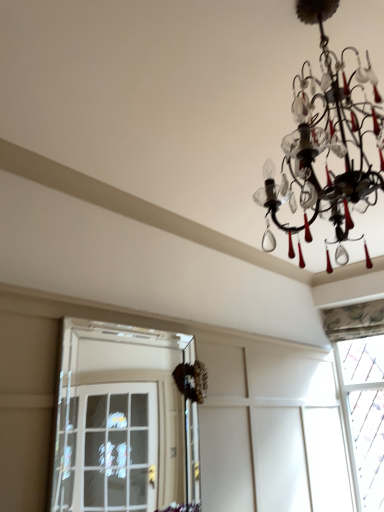
This screenshot has height=512, width=384. Identify the location of clear glass door at left, marked as the 1th window in a left-to-right arrangement. (118, 420).

You are a GUI agent. You are given a task and a screenshot of the screen. Output one action in this format:
    pyautogui.click(x=<x>, y=<y>)
    Task: Click on the clear glass door at left, which ranks as the second window in back-to-front order
    The height and width of the screenshot is (512, 384).
    Given the screenshot: What is the action you would take?
    pyautogui.click(x=118, y=420)

Considering the positions of point (366, 474) and point (383, 118), is point (366, 474) closer or farther from the camera than point (383, 118)?

Point (366, 474) is positioned farther from the camera compared to point (383, 118).

Is black glass chandelier at upper right completely or partially inside patterned fabric curtain at upper right, the first window in the right-to-left sequence?

That's incorrect, black glass chandelier at upper right is not inside patterned fabric curtain at upper right, the first window in the right-to-left sequence.

Consider the image. Is patterned fabric curtain at upper right, positioned as the second window in front-to-back order, closer to the viewer compared to black glass chandelier at upper right?

No, it is behind black glass chandelier at upper right.

Is clear glass door at left, which is the second window from right to left, directly adjacent to black glass chandelier at upper right?

No.

Considering the positions of objects clear glass door at left, placed as the first window when sorted from front to back, and black glass chandelier at upper right in the image provided, who is behind, clear glass door at left, placed as the first window when sorted from front to back, or black glass chandelier at upper right?

clear glass door at left, placed as the first window when sorted from front to back, is further from the camera.

Based on the photo, from a real-world perspective, which is physically above, clear glass door at left, which is the second window from right to left, or black glass chandelier at upper right?

black glass chandelier at upper right, from a real-world perspective.

Which is in front, point (82, 453) or point (381, 141)?

Positioned in front is point (381, 141).

Does clear glass door at left, placed as the first window when sorted from front to back, lie in front of patterned fabric curtain at upper right, the first window in the right-to-left sequence?

Yes, clear glass door at left, placed as the first window when sorted from front to back, is closer to the viewer.

Would you say clear glass door at left, marked as the 1th window in a left-to-right arrangement, is outside patterned fabric curtain at upper right, the first window in the right-to-left sequence?

clear glass door at left, marked as the 1th window in a left-to-right arrangement, is positioned outside patterned fabric curtain at upper right, the first window in the right-to-left sequence.

From a real-world perspective, is clear glass door at left, which ranks as the second window in back-to-front order, above or below patterned fabric curtain at upper right, the first window viewed from the back?

In terms of real-world spatial position, clear glass door at left, which ranks as the second window in back-to-front order, is below patterned fabric curtain at upper right, the first window viewed from the back.

Image resolution: width=384 pixels, height=512 pixels. What are the coordinates of `window in front of the patterned fabric curtain at upper right, the first window viewed from the back` in the screenshot? It's located at (118, 420).

Considering the positions of points (371, 489) and (137, 489), is point (371, 489) farther from camera compared to point (137, 489)?

That is False.

Which object is thinner, patterned fabric curtain at upper right, which is the 2th window in left-to-right order, or clear glass door at left, which ranks as the second window in back-to-front order?

clear glass door at left, which ranks as the second window in back-to-front order, is thinner.

Looking at this image, in terms of size, does patterned fabric curtain at upper right, positioned as the second window in front-to-back order, appear bigger or smaller than clear glass door at left, which is the second window from right to left?

patterned fabric curtain at upper right, positioned as the second window in front-to-back order, is bigger than clear glass door at left, which is the second window from right to left.

From the image's perspective, is black glass chandelier at upper right located above or below patterned fabric curtain at upper right, the first window viewed from the back?

black glass chandelier at upper right is above patterned fabric curtain at upper right, the first window viewed from the back.

Which of these two, black glass chandelier at upper right or patterned fabric curtain at upper right, the first window viewed from the back, is bigger?

black glass chandelier at upper right is bigger.

Is black glass chandelier at upper right located outside patterned fabric curtain at upper right, the first window in the right-to-left sequence?

Yes.

Visually, is black glass chandelier at upper right positioned to the left or to the right of patterned fabric curtain at upper right, which is the 2th window in left-to-right order?

black glass chandelier at upper right is to the left of patterned fabric curtain at upper right, which is the 2th window in left-to-right order.

From the image's perspective, is black glass chandelier at upper right on top of clear glass door at left, which ranks as the second window in back-to-front order?

Correct, black glass chandelier at upper right appears higher than clear glass door at left, which ranks as the second window in back-to-front order, in the image.

Does black glass chandelier at upper right lie behind clear glass door at left, placed as the first window when sorted from front to back?

No, the depth of black glass chandelier at upper right is less than that of clear glass door at left, placed as the first window when sorted from front to back.

Which of these two, black glass chandelier at upper right or clear glass door at left, marked as the 1th window in a left-to-right arrangement, is wider?

black glass chandelier at upper right is wider.

From a real-world perspective, is black glass chandelier at upper right below clear glass door at left, which ranks as the second window in back-to-front order?

No, from a real-world perspective, black glass chandelier at upper right is not beneath clear glass door at left, which ranks as the second window in back-to-front order.

I want to click on window that is the 2nd one when counting backward from the black glass chandelier at upper right, so click(361, 393).

From the image's perspective, which window is the 1st one below the black glass chandelier at upper right? Please provide its 2D coordinates.

[(118, 420)]

Based on their spatial positions, is clear glass door at left, placed as the first window when sorted from front to back, or patterned fabric curtain at upper right, which is the 2th window in left-to-right order, closer to black glass chandelier at upper right?

patterned fabric curtain at upper right, which is the 2th window in left-to-right order.

Considering their positions, is patterned fabric curtain at upper right, the first window in the right-to-left sequence, positioned further to clear glass door at left, placed as the first window when sorted from front to back, than black glass chandelier at upper right?

black glass chandelier at upper right is further to clear glass door at left, placed as the first window when sorted from front to back.

Which object lies further to the anchor point patterned fabric curtain at upper right, positioned as the second window in front-to-back order, black glass chandelier at upper right or clear glass door at left, placed as the first window when sorted from front to back?

black glass chandelier at upper right is further to patterned fabric curtain at upper right, positioned as the second window in front-to-back order.

When comparing their distances from patterned fabric curtain at upper right, the first window viewed from the back, does clear glass door at left, which ranks as the second window in back-to-front order, or black glass chandelier at upper right seem closer?

Based on the image, clear glass door at left, which ranks as the second window in back-to-front order, appears to be nearer to patterned fabric curtain at upper right, the first window viewed from the back.

Based on their spatial positions, is patterned fabric curtain at upper right, which is the 2th window in left-to-right order, or clear glass door at left, which is the second window from right to left, further from black glass chandelier at upper right?

clear glass door at left, which is the second window from right to left, lies further to black glass chandelier at upper right than the other object.

Looking at the image, which one is located further to clear glass door at left, placed as the first window when sorted from front to back, black glass chandelier at upper right or patterned fabric curtain at upper right, the first window in the right-to-left sequence?

Among the two, black glass chandelier at upper right is located further to clear glass door at left, placed as the first window when sorted from front to back.

Image resolution: width=384 pixels, height=512 pixels. I want to click on window located between black glass chandelier at upper right and patterned fabric curtain at upper right, the first window in the right-to-left sequence, in the depth direction, so click(x=118, y=420).